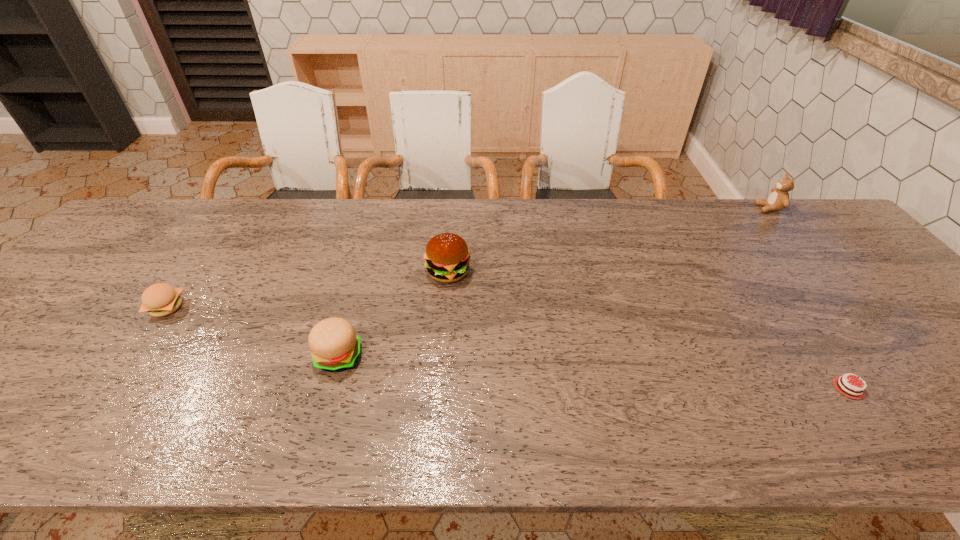
This screenshot has width=960, height=540. Identify the location of free spot that satisfies the following two spatial constraints: 1. on the back side of the fourth tallest object; 2. on the left side of the third object from left to right. pyautogui.click(x=191, y=272).